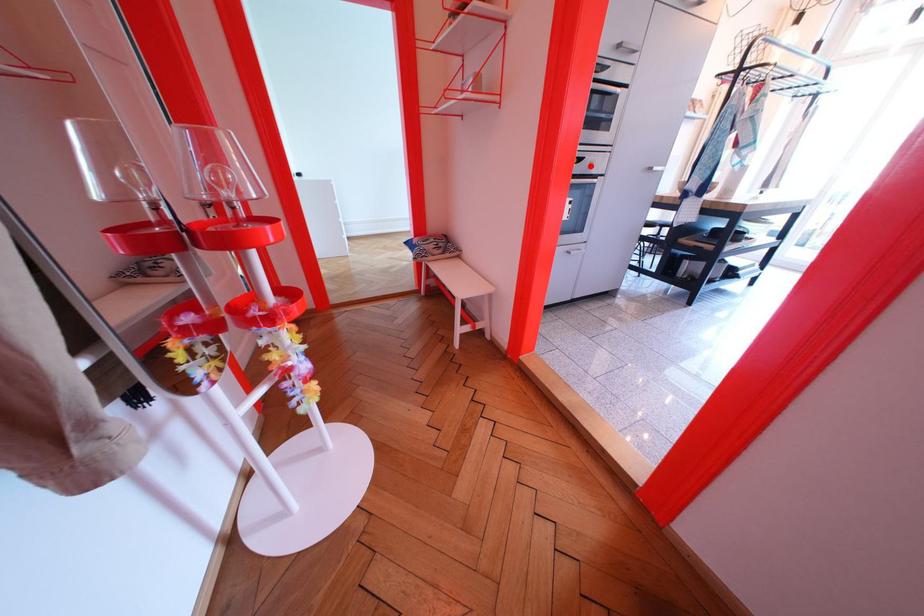
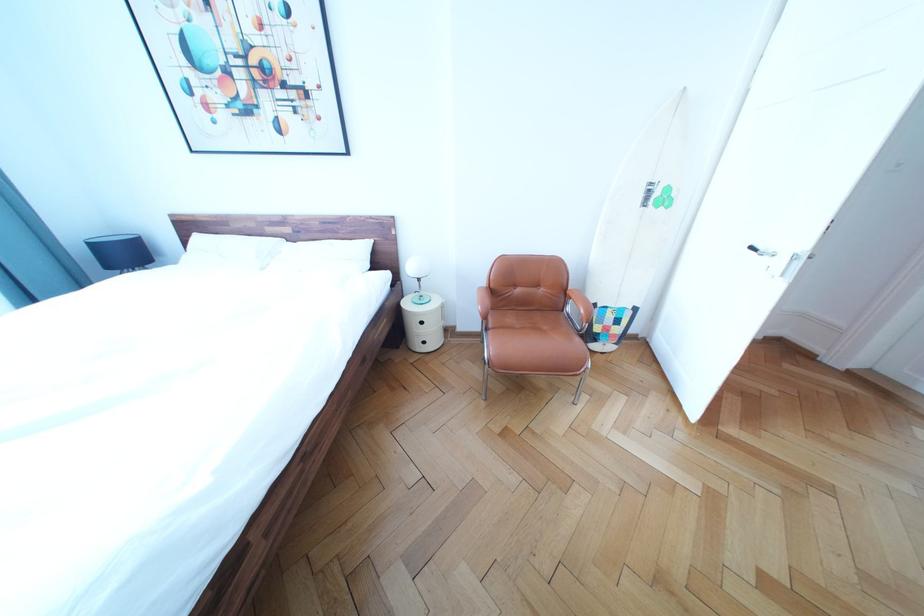
Question: I am providing you with two images of the same scene from different viewpoints. A red point is marked on the first image. Is the red point's position out of view in image 2?

Choices:
 (A) Yes
 (B) No

Answer: (A)